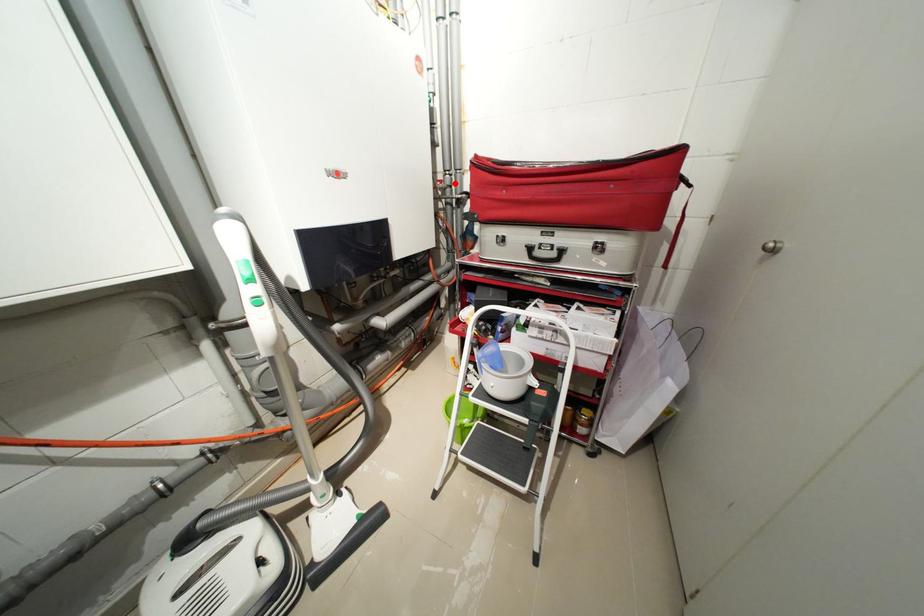
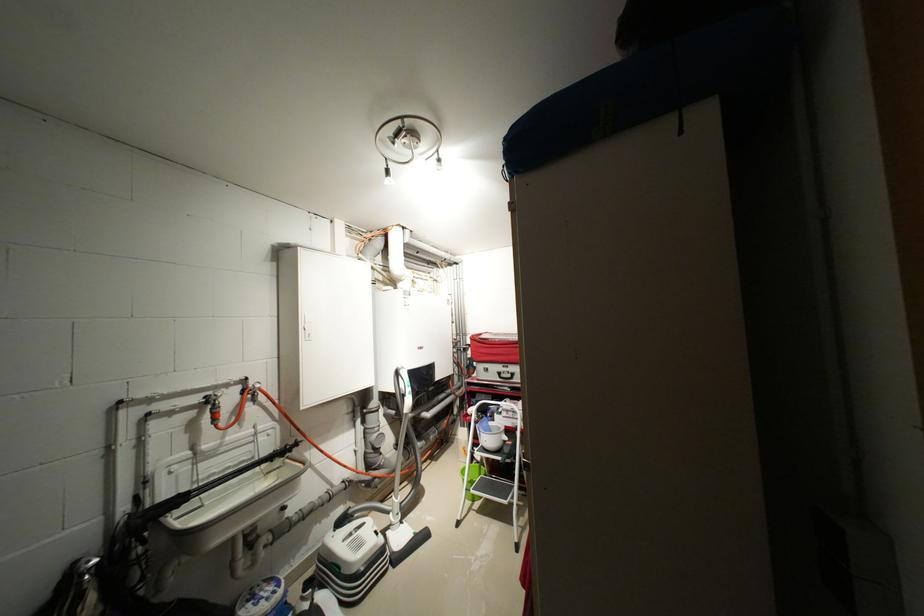
Question: I am providing you with two images of the same scene from different viewpoints. Given a red point in image1, look at the same physical point in image2. Is it:

Choices:
 (A) Closer to the viewpoint
 (B) Farther from the viewpoint

Answer: (B)